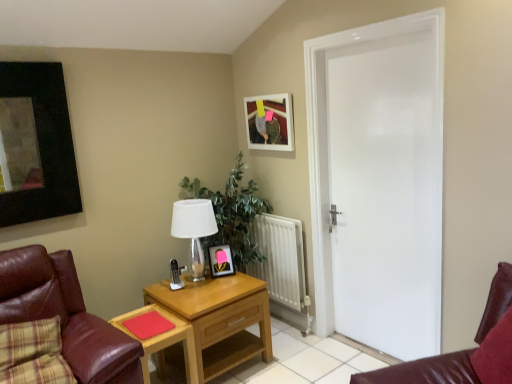
At what (x,y) coordinates should I click in order to perform the action: click on free space in front of white glass table lamp at center. Please return your answer as a coordinate pair (x, y). This screenshot has height=384, width=512. Looking at the image, I should click on (190, 296).